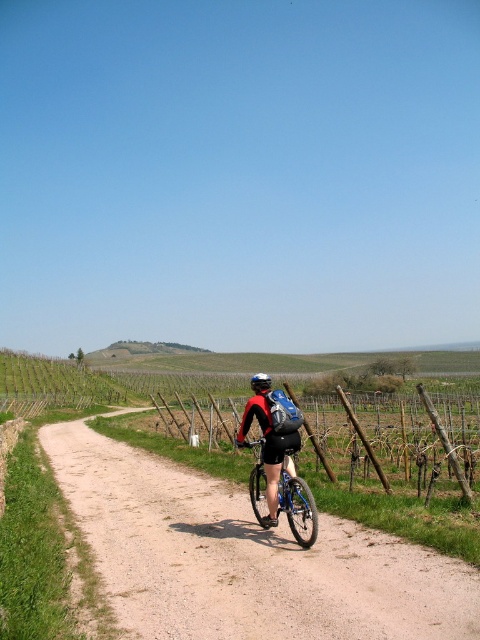
Question: Can you confirm if dirt path at center is positioned to the right of blue metallic bicycle at center?

Choices:
 (A) yes
 (B) no

Answer: (B)

Question: Can you confirm if dirt path at center is bigger than blue metallic bicycle at center?

Choices:
 (A) yes
 (B) no

Answer: (A)

Question: In this image, where is dirt path at center located relative to blue metallic bicycle at center?

Choices:
 (A) left
 (B) right

Answer: (A)

Question: Which of the following is the closest to the observer?

Choices:
 (A) blue metallic bicycle at center
 (B) dirt path at center

Answer: (B)